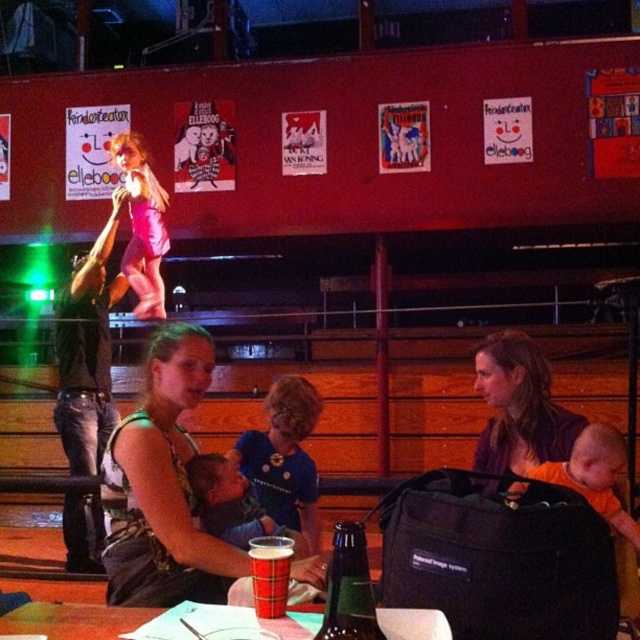
Question: Can you confirm if camouflage fabric baby carrier at center is smaller than green glass bottle at center?

Choices:
 (A) yes
 (B) no

Answer: (B)

Question: Estimate the real-world distances between objects in this image. Which object is closer to the camouflage fabric baby carrier at center?

Choices:
 (A) plaid paper cup at table center
 (B) soft blue shirt at center
 (C) matte purple tank top at center
 (D) matte plastic cup at center

Answer: (B)

Question: Is camouflage fabric baby carrier at center to the right of plaid paper cup at table center from the viewer's perspective?

Choices:
 (A) no
 (B) yes

Answer: (A)

Question: Considering the real-world distances, which object is closest to the matte purple tank top at center?

Choices:
 (A) matte plastic cup at center
 (B) soft blue shirt at center
 (C) green glass bottle at center

Answer: (B)

Question: In this image, where is green glass bottle at center located relative to plaid paper cup at table center?

Choices:
 (A) below
 (B) above

Answer: (B)

Question: Estimate the real-world distances between objects in this image. Which object is closer to the soft blue shirt at center?

Choices:
 (A) camouflage fabric baby carrier at center
 (B) green glass bottle at center
 (C) matte plastic cup at center

Answer: (A)